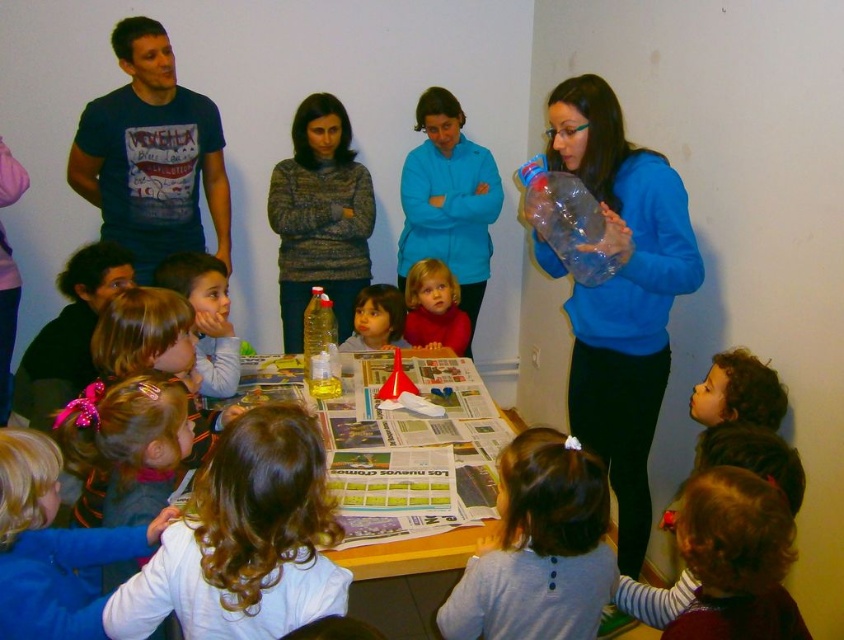
Which is more to the left, white curly hair at center or smooth blonde hair at center?

Positioned to the left is white curly hair at center.

Can you confirm if white curly hair at center is positioned to the left of smooth blonde hair at center?

Indeed, white curly hair at center is positioned on the left side of smooth blonde hair at center.

Between point (203, 497) and point (460, 324), which one is positioned in front?

Point (203, 497) is in front.

The image size is (844, 640). What are the coordinates of `white curly hair at center` in the screenshot? It's located at (244, 540).

At what (x,y) coordinates should I click in order to perform the action: click on white curly hair at center. Please return your answer as a coordinate pair (x, y). Looking at the image, I should click on (244, 540).

Describe the element at coordinates (244, 540) in the screenshot. I see `white curly hair at center` at that location.

Does point (138, 609) lie behind point (333, 364)?

No, (138, 609) is closer to viewer.

Find the location of a particular element. Image resolution: width=844 pixels, height=640 pixels. white curly hair at center is located at coordinates (244, 540).

What do you see at coordinates (322, 349) in the screenshot?
I see `translucent plastic bottle at table center` at bounding box center [322, 349].

In order to click on translucent plastic bottle at table center in this screenshot , I will do `click(322, 349)`.

What do you see at coordinates (322, 349) in the screenshot? I see `translucent plastic bottle at table center` at bounding box center [322, 349].

At what (x,y) coordinates should I click in order to perform the action: click on translucent plastic bottle at table center. Please return your answer as a coordinate pair (x, y). Looking at the image, I should click on (322, 349).